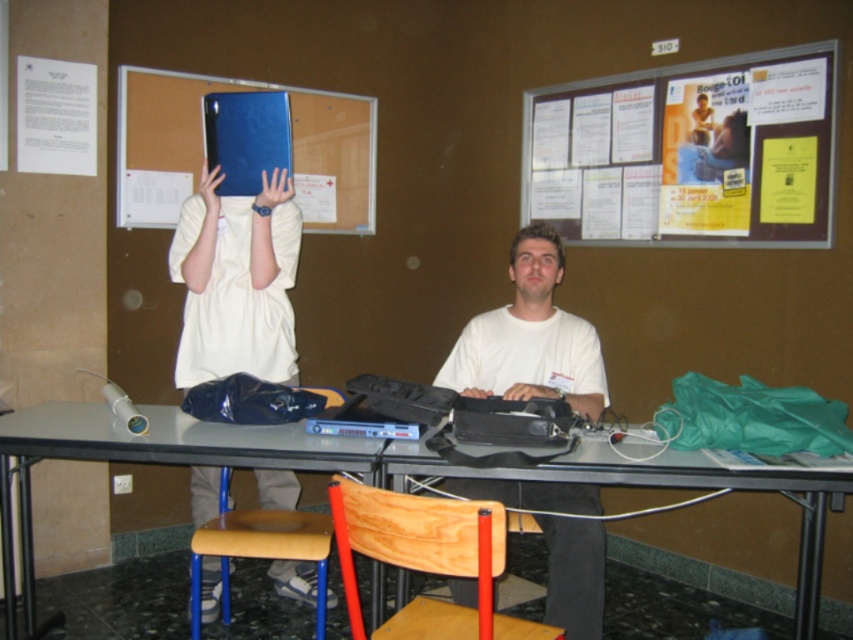
Does point (62, 109) come farther from viewer compared to point (198, 189)?

Yes, it is behind point (198, 189).

Does white paper at upper left appear on the left side of matte blue folder at upper left?

Indeed, white paper at upper left is positioned on the left side of matte blue folder at upper left.

I want to click on white paper at upper left, so click(x=55, y=116).

The width and height of the screenshot is (853, 640). Identify the location of white paper at upper left. (55, 116).

Which is in front, point (258, 461) or point (331, 532)?

Point (258, 461)

Between metallic gray table at center and wooden seat at lower center, which one has less height?

Standing shorter between the two is wooden seat at lower center.

Who is more forward, (407,465) or (317,573)?

Point (407,465)

Identify the location of metallic gray table at center. The width and height of the screenshot is (853, 640). (198, 442).

Does white matte shirt at center have a greater width compared to blue plastic folder at upper center?

Incorrect, white matte shirt at center's width does not surpass blue plastic folder at upper center's.

Between point (567, 520) and point (178, 140), which one is positioned behind?

Point (178, 140)

Is point (457, 380) behind point (312, 209)?

That is False.

This screenshot has height=640, width=853. I want to click on white matte shirt at center, so click(x=531, y=337).